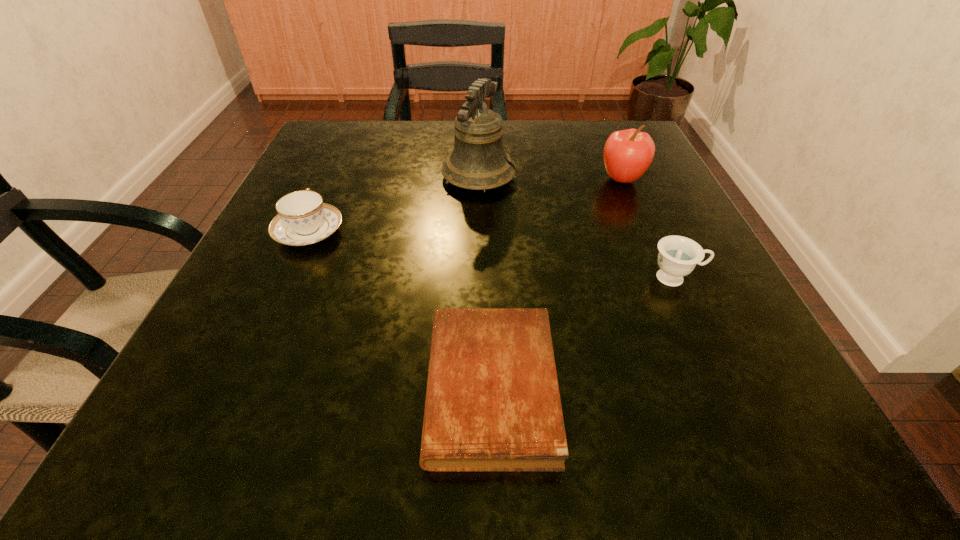
Choose which object is the second nearest neighbor to the fourth farthest object. Please provide its 2D coordinates. Your answer should be formatted as a tuple, i.e. [(x, y)], where the tuple contains the x and y coordinates of a point satisfying the conditions above.

[(627, 155)]

The height and width of the screenshot is (540, 960). Identify the location of the closest object to the bell. (303, 219).

I want to click on vacant space that satisfies the following two spatial constraints: 1. on the side with the handle of the tallest object; 2. on the left side of the leftmost object, so click(x=334, y=177).

This screenshot has width=960, height=540. In order to click on vacant region that satisfies the following two spatial constraints: 1. on the side with the handle of the bell; 2. on the left side of the leftmost object in this screenshot , I will do `click(334, 177)`.

Locate an element on the screen. free space that satisfies the following two spatial constraints: 1. on the side with the handle of the apple; 2. on the right side of the third farthest object is located at coordinates (333, 179).